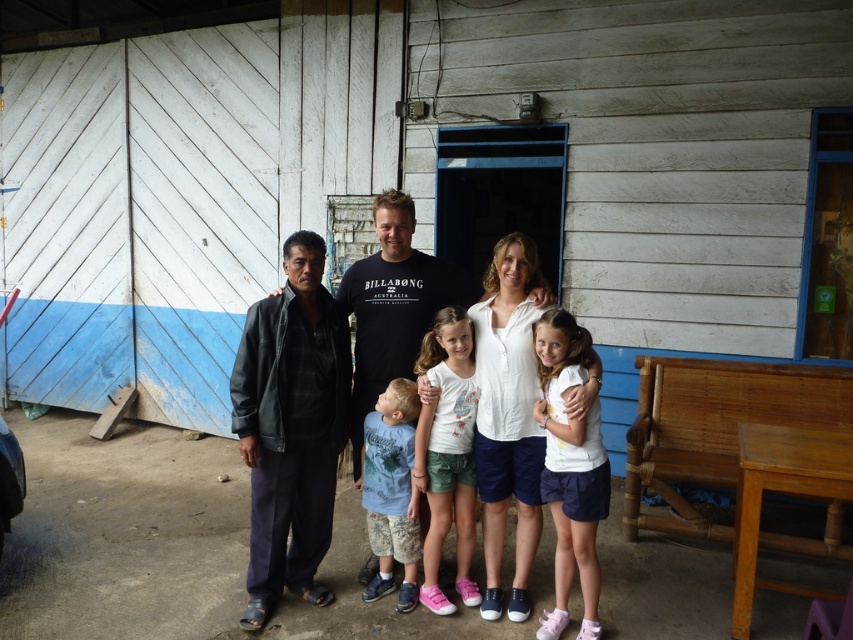
Question: Is light blue cotton shirt at lower left behind matte black jacket at center?

Choices:
 (A) no
 (B) yes

Answer: (A)

Question: Does white matte shirt at center have a smaller size compared to light blue cotton shirt at lower left?

Choices:
 (A) no
 (B) yes

Answer: (A)

Question: Which object is positioned farthest from the light blue cotton shirt at lower left?

Choices:
 (A) white cotton shirt at center
 (B) white matte shirt at center
 (C) dark gray leather jacket at left
 (D) matte black jacket at center

Answer: (B)

Question: Is dark gray leather jacket at left smaller than white cotton shirt at center?

Choices:
 (A) no
 (B) yes

Answer: (A)

Question: Which point is closer to the camera taking this photo?

Choices:
 (A) (373, 579)
 (B) (572, 481)
 (C) (408, 227)
 (D) (283, 321)

Answer: (B)

Question: Which point is closer to the camera?

Choices:
 (A) white matte shirt at center
 (B) light blue cotton shirt at lower left
 (C) dark gray leather jacket at left
 (D) matte black jacket at center

Answer: (A)